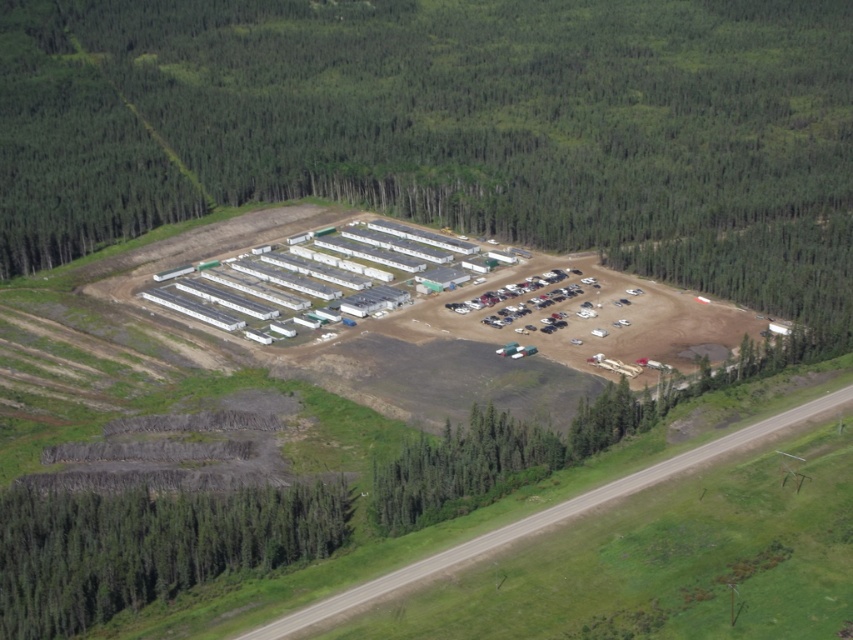
You are a drone operator flying over an industrial site in a forest. You need to determine the order of two points from closest to farthest from your current position. The points are point 1 at point (61, 221) and point 2 at point (325, 536). Based on the aerial view, which point is closer to you?

Point 1 at point (61, 221) is closer to you because it is further to the viewer than point 2 at point (325, 536).

You are a drone operator flying over a construction site in a forest. You notice two groups of trees in the image. One is labeled as green leafy trees at center and the other as green textured trees at lower left. Which group of trees is taller?

The green leafy trees at center are much taller than the green textured trees at lower left according to the description.